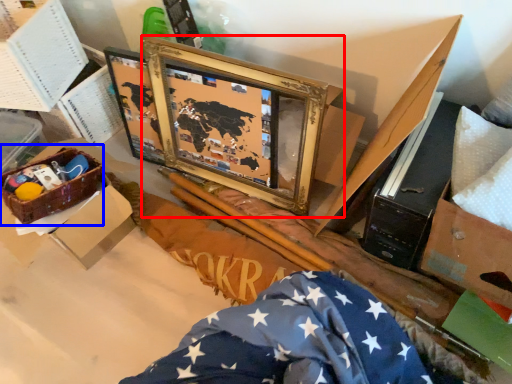
Question: Which object is further to the camera taking this photo, picture frame (highlighted by a red box) or crate (highlighted by a blue box)?

Choices:
 (A) picture frame
 (B) crate

Answer: (B)